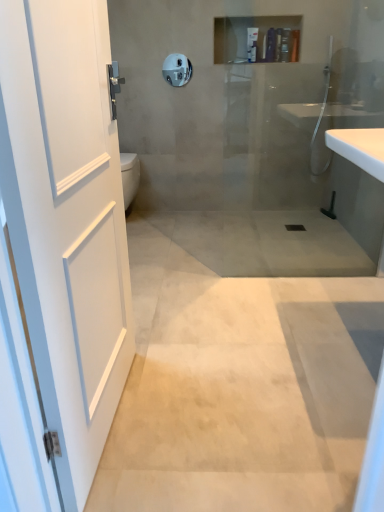
Question: Which direction should I rotate to face matte plastic bottle at upper center, the first toiletry viewed from the left, — up or down?

Choices:
 (A) up
 (B) down

Answer: (A)

Question: Is satin nickel towel bar at upper center taller than white matte door at left?

Choices:
 (A) yes
 (B) no

Answer: (B)

Question: Is the surface of satin nickel towel bar at upper center in direct contact with white matte door at left?

Choices:
 (A) yes
 (B) no

Answer: (B)

Question: Does satin nickel towel bar at upper center come in front of white matte door at left?

Choices:
 (A) yes
 (B) no

Answer: (B)

Question: From a real-world perspective, is satin nickel towel bar at upper center positioned under white matte door at left based on gravity?

Choices:
 (A) yes
 (B) no

Answer: (B)

Question: Does satin nickel towel bar at upper center lie behind white matte door at left?

Choices:
 (A) no
 (B) yes

Answer: (B)

Question: Could you tell me if satin nickel towel bar at upper center is turned towards white matte door at left?

Choices:
 (A) yes
 (B) no

Answer: (A)

Question: Is satin nickel towel bar at upper center shorter than matte plastic shampoo bottle at upper center, marked as the first toiletry in a right-to-left arrangement?

Choices:
 (A) yes
 (B) no

Answer: (B)

Question: From the image's perspective, is satin nickel towel bar at upper center under matte plastic shampoo bottle at upper center, marked as the first toiletry in a right-to-left arrangement?

Choices:
 (A) no
 (B) yes

Answer: (B)

Question: Is satin nickel towel bar at upper center positioned beyond the bounds of matte plastic shampoo bottle at upper center, which is the third toiletry from left to right?

Choices:
 (A) no
 (B) yes

Answer: (B)

Question: Is satin nickel towel bar at upper center oriented towards matte plastic shampoo bottle at upper center, marked as the first toiletry in a right-to-left arrangement?

Choices:
 (A) no
 (B) yes

Answer: (A)

Question: Is matte plastic shampoo bottle at upper center, marked as the first toiletry in a right-to-left arrangement, completely or partially inside satin nickel towel bar at upper center?

Choices:
 (A) no
 (B) yes

Answer: (A)

Question: Does satin nickel towel bar at upper center have a lesser width compared to matte plastic shampoo bottle at upper center, marked as the first toiletry in a right-to-left arrangement?

Choices:
 (A) yes
 (B) no

Answer: (A)

Question: Does matte plastic shampoo bottle at upper center, marked as the first toiletry in a right-to-left arrangement, have a larger size compared to satin nickel towel bar at upper center?

Choices:
 (A) yes
 (B) no

Answer: (A)